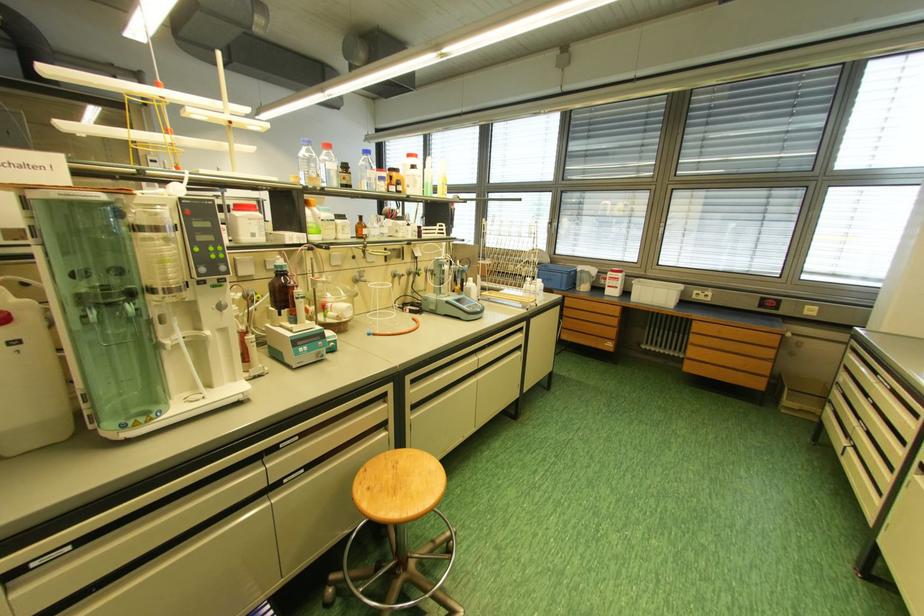
Describe the element at coordinates (398, 485) in the screenshot. The width and height of the screenshot is (924, 616). I see `the chair sitting surface` at that location.